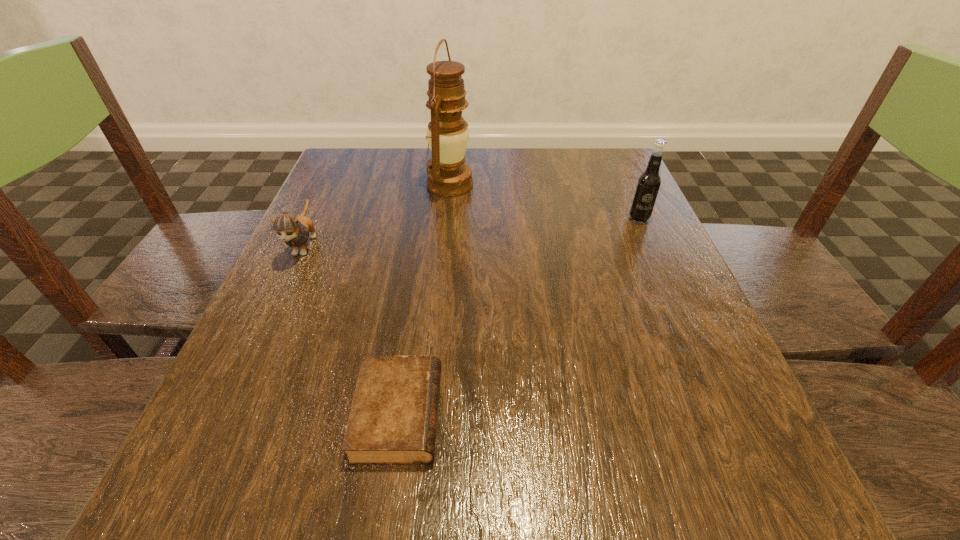
Where is `blank space located on the front-facing side of the kitten`? Image resolution: width=960 pixels, height=540 pixels. blank space located on the front-facing side of the kitten is located at coordinates (271, 317).

This screenshot has height=540, width=960. I want to click on vacant area situated on the spine side of the shortest object, so click(540, 414).

Find the location of a particular element. The width and height of the screenshot is (960, 540). object present at the far edge is located at coordinates (448, 175).

This screenshot has width=960, height=540. Identify the location of object at the near edge. (393, 419).

Locate an element on the screen. This screenshot has height=540, width=960. object present at the left edge is located at coordinates (293, 230).

The height and width of the screenshot is (540, 960). I want to click on object that is at the right edge, so coord(648,184).

In the image, there is a desktop. Where is `free region at the far edge`? The height and width of the screenshot is (540, 960). free region at the far edge is located at coordinates (404, 147).

I want to click on vacant space at the left edge of the desktop, so click(x=306, y=268).

The height and width of the screenshot is (540, 960). In the image, there is a desktop. Find the location of `vacant space at the right edge`. vacant space at the right edge is located at coordinates (686, 326).

The height and width of the screenshot is (540, 960). I want to click on vacant space at the far left corner of the desktop, so click(x=394, y=152).